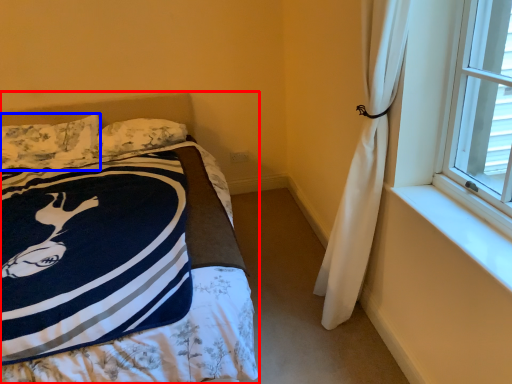
Question: Which object appears closest to the camera in this image, bed (highlighted by a red box) or pillow (highlighted by a blue box)?

Choices:
 (A) bed
 (B) pillow

Answer: (A)